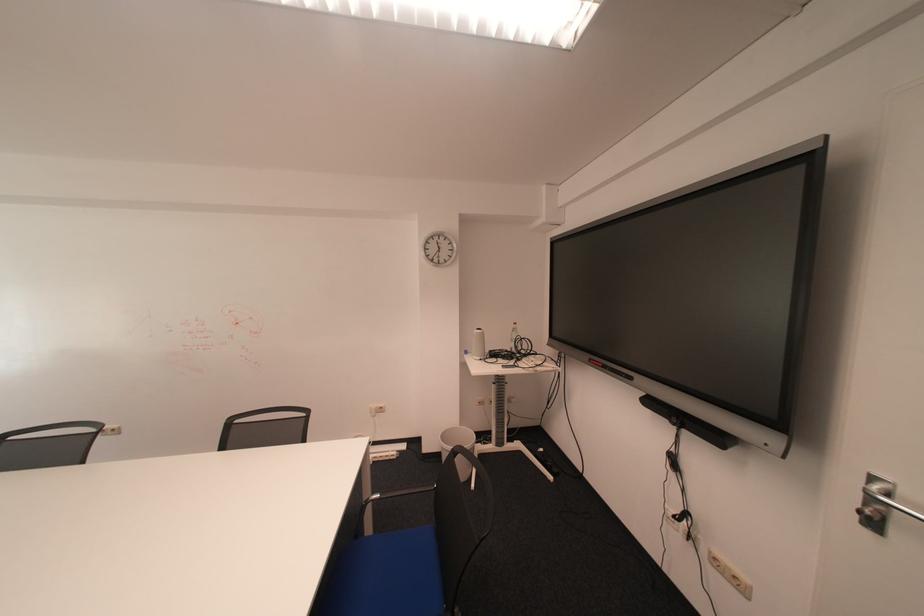
Where would you lift the white thermos bottle? Please return your answer as a coordinate pair (x, y).

(478, 344)